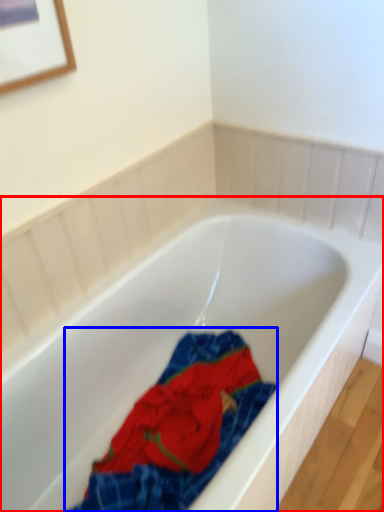
Question: Among these objects, which one is nearest to the camera, bathtub (highlighted by a red box) or material (highlighted by a blue box)?

Choices:
 (A) bathtub
 (B) material

Answer: (A)